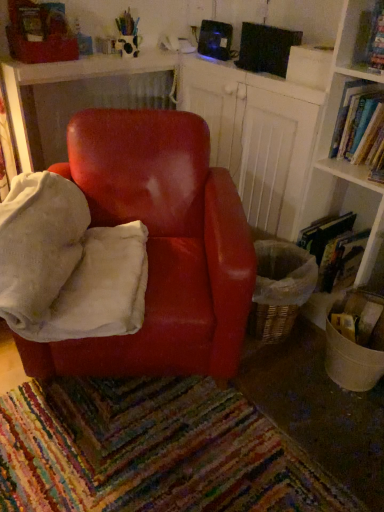
Question: Is velvety white bean bag at center inside the boundaries of glossy wood table at center, or outside?

Choices:
 (A) outside
 (B) inside

Answer: (A)

Question: From a real-world perspective, is velvety white bean bag at center positioned above or below glossy wood table at center?

Choices:
 (A) above
 (B) below

Answer: (B)

Question: Based on their relative distances, which object is farther from the wooden bookshelf at upper right?

Choices:
 (A) glossy wood table at center
 (B) hardcover book at right, placed as the first book when sorted from bottom to top
 (C) hardcover book at upper right, which ranks as the 2th book in bottom-to-top order
 (D) glossy leather chair at center
 (E) velvety white bean bag at center

Answer: (E)

Question: Which is farther from the hardcover book at upper right, positioned as the first book in top-to-bottom order?

Choices:
 (A) glossy wood table at center
 (B) wooden bookshelf at upper right
 (C) velvety white bean bag at center
 (D) hardcover book at right, placed as the first book when sorted from bottom to top
 (E) glossy leather chair at center

Answer: (A)